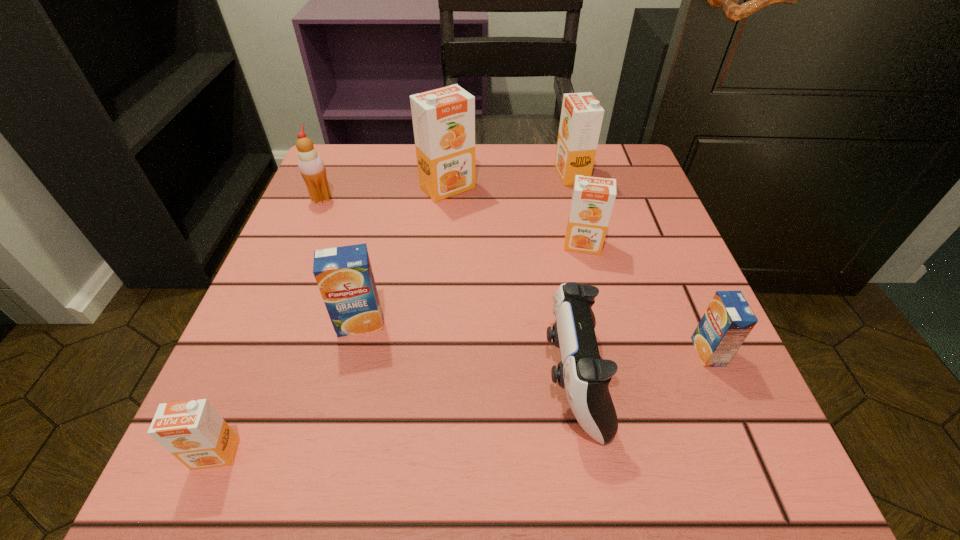
Identify which orange orange juice is the second closest to the third smallest orange orange juice. Please provide its 2D coordinates. Your answer should be formatted as a tuple, i.e. [(x, y)], where the tuple contains the x and y coordinates of a point satisfying the conditions above.

[(443, 119)]

Where is `free location that satisfies the following two spatial constraints: 1. on the front side of the third farthest orange orange juice; 2. on the front-facing side of the control`? This screenshot has width=960, height=540. free location that satisfies the following two spatial constraints: 1. on the front side of the third farthest orange orange juice; 2. on the front-facing side of the control is located at coordinates (615, 380).

You are a GUI agent. You are given a task and a screenshot of the screen. Output one action in this format:
    pyautogui.click(x=<x>, y=<y>)
    Task: Click on the free spot that satisfies the following two spatial constraints: 1. on the front side of the fifth shortest orange_juice; 2. on the front-facing side of the control
    The height and width of the screenshot is (540, 960).
    Given the screenshot: What is the action you would take?
    pyautogui.click(x=624, y=380)

At what (x,y) coordinates should I click in order to perform the action: click on vacant space that satisfies the following two spatial constraints: 1. on the back side of the nearest orange_juice; 2. at the front with a straw on the icecream. Please return your answer as a coordinate pair (x, y). The image size is (960, 540). Looking at the image, I should click on (322, 199).